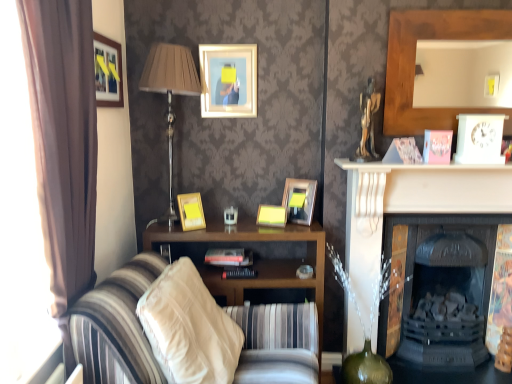
The image size is (512, 384). Describe the element at coordinates (191, 211) in the screenshot. I see `matte yellow picture frame at center, positioned as the 2th picture frame in left-to-right order` at that location.

This screenshot has height=384, width=512. Describe the element at coordinates (228, 81) in the screenshot. I see `matte gold picture frame at upper center, the 3th picture frame when ordered from left to right` at that location.

This screenshot has height=384, width=512. Describe the element at coordinates (170, 94) in the screenshot. I see `metallic silver table lamp at left` at that location.

Where is `brown fabric curtain at left`? The width and height of the screenshot is (512, 384). brown fabric curtain at left is located at coordinates (63, 145).

Find the location of a particular element. The image size is (512, 384). striped fabric couch at center is located at coordinates (117, 326).

Image resolution: width=512 pixels, height=384 pixels. Find the location of `yellow matte picture frame at center, the second picture frame positioned from the right`. yellow matte picture frame at center, the second picture frame positioned from the right is located at coordinates (271, 216).

Where is `matte yellow picture frame at center, the 4th picture frame in the right-to-left sequence`? This screenshot has height=384, width=512. matte yellow picture frame at center, the 4th picture frame in the right-to-left sequence is located at coordinates (191, 211).

Would you say matte gold picture frame at upper center, the 3th picture frame when ordered from left to right, is to the left or to the right of matte gold picture frame at upper left, which is the first picture frame in left-to-right order, in the picture?

matte gold picture frame at upper center, the 3th picture frame when ordered from left to right, is to the right of matte gold picture frame at upper left, which is the first picture frame in left-to-right order.

Are matte gold picture frame at upper center, the 3th picture frame when ordered from left to right, and matte gold picture frame at upper left, which appears as the fifth picture frame when viewed from the right, located far from each other?

No, matte gold picture frame at upper center, the 3th picture frame when ordered from left to right, is in close proximity to matte gold picture frame at upper left, which appears as the fifth picture frame when viewed from the right.

Consider the image. Would you say matte gold picture frame at upper left, which appears as the fifth picture frame when viewed from the right, is part of matte gold picture frame at upper center, the 3th picture frame when ordered from left to right,'s contents?

No, matte gold picture frame at upper left, which appears as the fifth picture frame when viewed from the right, is located outside of matte gold picture frame at upper center, the 3th picture frame when ordered from left to right.

Is matte gold picture frame at upper center, the 3th picture frame when ordered from left to right, aimed at matte gold picture frame at upper left, which appears as the fifth picture frame when viewed from the right?

No.

Which is in front, point (197, 195) or point (224, 254)?

The point (197, 195) is more forward.

Is matte yellow picture frame at center, positioned as the 2th picture frame in left-to-right order, looking in the opposite direction of hardcover book at center?

matte yellow picture frame at center, positioned as the 2th picture frame in left-to-right order, is not turned away from hardcover book at center.

You are a GUI agent. You are given a task and a screenshot of the screen. Output one action in this format:
    pyautogui.click(x=<x>, y=<y>)
    Task: Click on the book below the matte yellow picture frame at center, the 4th picture frame in the right-to-left sequence (from a real-world perspective)
    This screenshot has height=384, width=512.
    Given the screenshot: What is the action you would take?
    pyautogui.click(x=229, y=257)

From a real-world perspective, is matte yellow picture frame at center, positioned as the 2th picture frame in left-to-right order, positioned under hardcover book at center based on gravity?

No, from a real-world perspective, matte yellow picture frame at center, positioned as the 2th picture frame in left-to-right order, is not under hardcover book at center.

Does matte gold picture frame at upper left, which appears as the fifth picture frame when viewed from the right, turn towards metallic silver table lamp at left?

No, matte gold picture frame at upper left, which appears as the fifth picture frame when viewed from the right, is not turned towards metallic silver table lamp at left.

Which object is closer to the camera taking this photo, matte gold picture frame at upper left, which is the first picture frame in left-to-right order, or metallic silver table lamp at left?

matte gold picture frame at upper left, which is the first picture frame in left-to-right order, is more forward.

Consider the image. Is matte gold picture frame at upper left, which is the first picture frame in left-to-right order, located outside metallic silver table lamp at left?

matte gold picture frame at upper left, which is the first picture frame in left-to-right order, is positioned outside metallic silver table lamp at left.

In terms of height, does matte gold picture frame at upper center, the 3th picture frame when ordered from left to right, look taller or shorter compared to hardcover book at center?

In the image, matte gold picture frame at upper center, the 3th picture frame when ordered from left to right, appears to be taller than hardcover book at center.

Measure the distance between matte gold picture frame at upper center, which is counted as the third picture frame, starting from the right, and hardcover book at center.

35.18 inches.

Is matte gold picture frame at upper center, which is counted as the third picture frame, starting from the right, touching hardcover book at center?

No, matte gold picture frame at upper center, which is counted as the third picture frame, starting from the right, is not in contact with hardcover book at center.

Which of these two, matte gold picture frame at upper center, the 3th picture frame when ordered from left to right, or hardcover book at center, is wider?

With larger width is hardcover book at center.

Is metallic silver table lamp at left not within matte gold picture frame at upper center, which is counted as the third picture frame, starting from the right?

Yes, metallic silver table lamp at left is not within matte gold picture frame at upper center, which is counted as the third picture frame, starting from the right.

Considering their positions, is metallic silver table lamp at left located in front of or behind matte gold picture frame at upper center, the 3th picture frame when ordered from left to right?

In the image, metallic silver table lamp at left appears in front of matte gold picture frame at upper center, the 3th picture frame when ordered from left to right.

Where is `the 2nd picture frame to the right of the metallic silver table lamp at left, starting your count from the anchor`? This screenshot has width=512, height=384. the 2nd picture frame to the right of the metallic silver table lamp at left, starting your count from the anchor is located at coordinates (228, 81).

Looking at their sizes, would you say metallic silver table lamp at left is wider or thinner than matte gold picture frame at upper center, the 3th picture frame when ordered from left to right?

Considering their sizes, metallic silver table lamp at left looks broader than matte gold picture frame at upper center, the 3th picture frame when ordered from left to right.

Choose the correct answer: Is striped fabric couch at center inside brown fabric curtain at left or outside it?

striped fabric couch at center is outside brown fabric curtain at left.

Is striped fabric couch at center at the right side of brown fabric curtain at left?

Correct, you'll find striped fabric couch at center to the right of brown fabric curtain at left.

This screenshot has height=384, width=512. In order to click on curtain that appears above the striped fabric couch at center (from the image's perspective) in this screenshot , I will do `click(63, 145)`.

Image resolution: width=512 pixels, height=384 pixels. What are the coordinates of `pillow on the left of yellow matte picture frame at center, the second picture frame positioned from the right` in the screenshot? It's located at (189, 328).

How many degrees apart are the facing directions of beige fabric pillow at lower center and yellow matte picture frame at center, the fourth picture frame positioned from the left?

The facing directions of beige fabric pillow at lower center and yellow matte picture frame at center, the fourth picture frame positioned from the left, are 94.3 degrees apart.

Is point (167, 371) farther from camera compared to point (268, 205)?

No.

Identify the location of the 1st picture frame below the matte gold picture frame at upper center, the 3th picture frame when ordered from left to right (from the image's perspective). point(108,72).

Locate an element on the screen. The width and height of the screenshot is (512, 384). book behind the matte yellow picture frame at center, positioned as the 2th picture frame in left-to-right order is located at coordinates (229, 257).

Estimate the real-world distances between objects in this image. Which object is closer to matte gold picture frame at upper left, which appears as the fifth picture frame when viewed from the right, matte gold picture frame at center, the fifth picture frame positioned from the left, or hardcover book at center?

hardcover book at center is positioned closer to the anchor matte gold picture frame at upper left, which appears as the fifth picture frame when viewed from the right.

Which object lies nearer to the anchor point matte yellow picture frame at center, positioned as the 2th picture frame in left-to-right order, white matte fireplace at center or matte gold picture frame at center, the fifth picture frame positioned from the left?

The object closer to matte yellow picture frame at center, positioned as the 2th picture frame in left-to-right order, is matte gold picture frame at center, the fifth picture frame positioned from the left.

Considering their positions, is matte gold picture frame at center, the fifth picture frame positioned from the left, positioned closer to brown fabric curtain at left than striped fabric couch at center?

striped fabric couch at center is closer to brown fabric curtain at left.

Based on their spatial positions, is matte yellow picture frame at center, positioned as the 2th picture frame in left-to-right order, or yellow matte picture frame at center, the fourth picture frame positioned from the left, further from striped fabric couch at center?

yellow matte picture frame at center, the fourth picture frame positioned from the left, is further to striped fabric couch at center.

Considering their positions, is yellow matte picture frame at center, the fourth picture frame positioned from the left, positioned closer to brown fabric curtain at left than matte gold picture frame at center, which is the first picture frame from right to left?

yellow matte picture frame at center, the fourth picture frame positioned from the left, is positioned closer to the anchor brown fabric curtain at left.

When comparing their distances from yellow matte picture frame at center, the second picture frame positioned from the right, does matte yellow picture frame at center, the 4th picture frame in the right-to-left sequence, or matte gold picture frame at upper center, which is counted as the third picture frame, starting from the right, seem further?

matte gold picture frame at upper center, which is counted as the third picture frame, starting from the right.

Consider the image. From the image, which object appears to be farther from striped fabric couch at center, brown fabric curtain at left or matte gold picture frame at center, which is the first picture frame from right to left?

matte gold picture frame at center, which is the first picture frame from right to left, is positioned further to the anchor striped fabric couch at center.

Estimate the real-world distances between objects in this image. Which object is closer to hardcover book at center, beige fabric pillow at lower center or brown fabric curtain at left?

beige fabric pillow at lower center.

You are a GUI agent. You are given a task and a screenshot of the screen. Output one action in this format:
    pyautogui.click(x=<x>, y=<y>)
    Task: Click on the table lamp between matte gold picture frame at upper center, which is counted as the third picture frame, starting from the right, and beige fabric pillow at lower center from top to bottom
    The height and width of the screenshot is (384, 512).
    Given the screenshot: What is the action you would take?
    pyautogui.click(x=170, y=94)

This screenshot has width=512, height=384. I want to click on curtain that lies between matte gold picture frame at upper left, which is the first picture frame in left-to-right order, and beige fabric pillow at lower center from top to bottom, so 63,145.

Locate an element on the screen. table lamp between matte gold picture frame at upper left, which appears as the fifth picture frame when viewed from the right, and striped fabric couch at center, in the vertical direction is located at coordinates (170, 94).

Locate an element on the screen. The image size is (512, 384). table lamp positioned between beige fabric pillow at lower center and hardcover book at center from near to far is located at coordinates (170, 94).